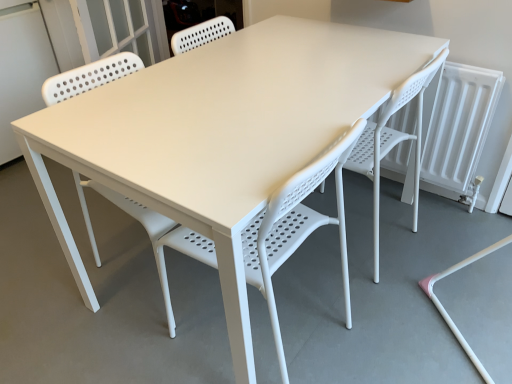
Where is `vacant area that is in front of white plastic chair at center, which appears as the second chair when viewed from the left`? This screenshot has width=512, height=384. vacant area that is in front of white plastic chair at center, which appears as the second chair when viewed from the left is located at coordinates (381, 311).